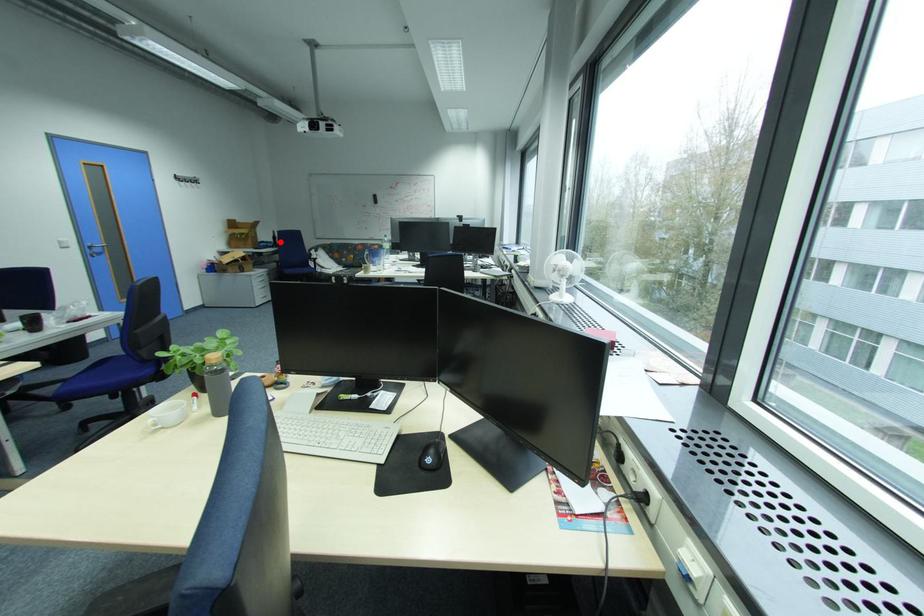
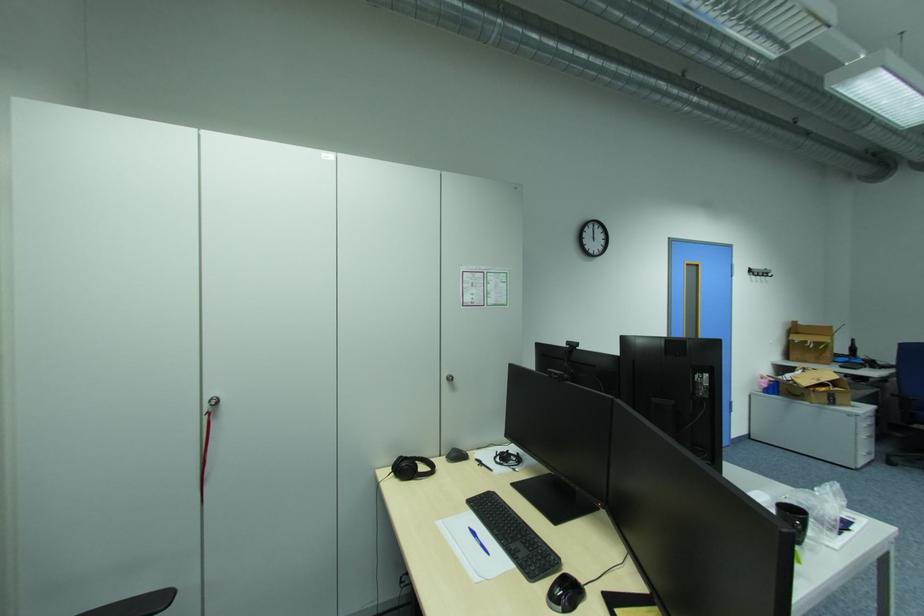
The point at the highlighted location is marked in the first image. Where is the corresponding point in the second image?

(855, 354)